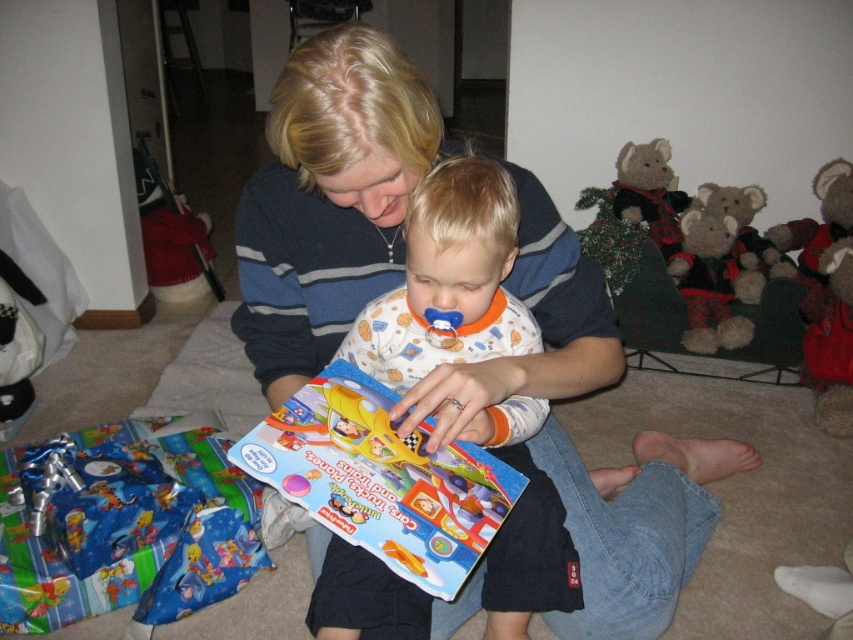
Does matte blue sweater at center appear under flannel plush bear at right?

Indeed, matte blue sweater at center is positioned under flannel plush bear at right.

Which is in front, point (541, 369) or point (680, 225)?

Point (541, 369) is in front.

Where is `matte blue sweater at center`? matte blue sweater at center is located at coordinates (329, 198).

Is point (276, 195) positioned after point (512, 628)?

No.

Which of these two, matte blue sweater at center or white cotton onesie at center, stands shorter?

white cotton onesie at center is shorter.

Is point (558, 348) positioned in front of point (444, 225)?

No.

This screenshot has width=853, height=640. Identify the location of matte blue sweater at center. (329, 198).

Is white cotton onesie at center closer to the viewer compared to matte plastic book at center?

No, it is behind matte plastic book at center.

Is point (552, 534) behind point (476, 516)?

Yes.

Identify the location of white cotton onesie at center. (448, 280).